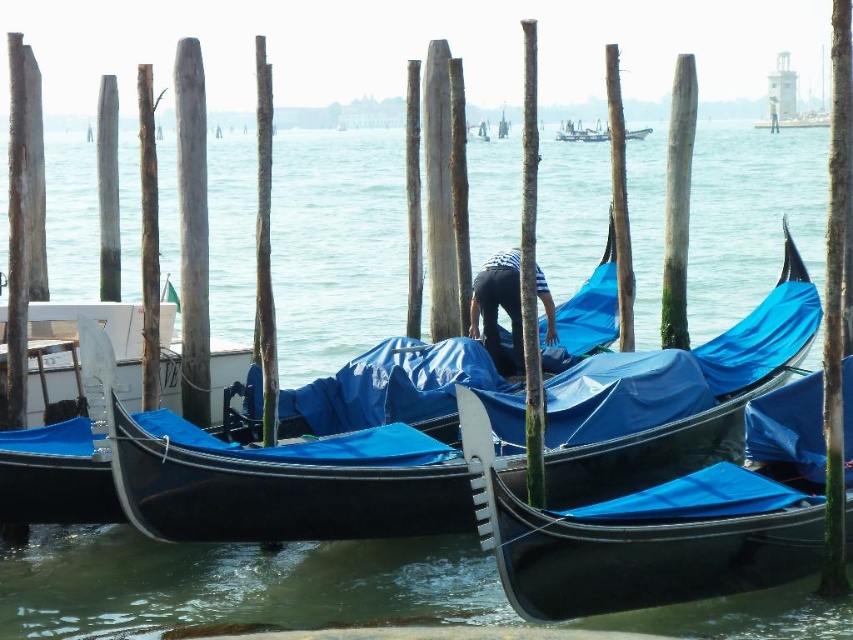
You are a tourist standing on the dock in Venice and want to take a photo of the blue tarpaulin canoe at center and the blue tarpaulin boat at center. Which one should you aim your camera at first if you want to capture both in one shot without moving the camera?

You should aim your camera at the blue tarpaulin boat at center first because it is above the blue tarpaulin canoe at center, so capturing it first will ensure both are in frame without needing to adjust the camera position.

You are standing on the dock and want to board the shiny blue gondola at center and the blue tarpaulin boat at center. Which one is closer to you?

The shiny blue gondola at center is in front of the blue tarpaulin boat at center, so the shiny blue gondola at center is closer to you.